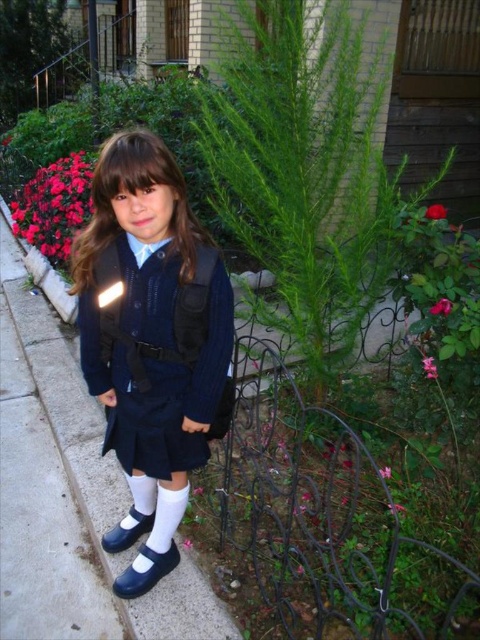
Question: Is white smooth sock at lower center below glossy rose at right?

Choices:
 (A) no
 (B) yes

Answer: (B)

Question: Is shiny black shoe at lower center closer to the viewer compared to matte blue shoe at lower left?

Choices:
 (A) yes
 (B) no

Answer: (A)

Question: Among these objects, which one is nearest to the camera?

Choices:
 (A) pink matte rose at center right
 (B) shiny black shoe at lower center

Answer: (B)

Question: Can you confirm if matte blue dress at center is wider than glossy rose at right?

Choices:
 (A) yes
 (B) no

Answer: (A)

Question: Which object appears closest to the camera in this image?

Choices:
 (A) white smooth sock at lower center
 (B) glossy rose at right
 (C) pink matte rose at center right
 (D) shiny black shoe at lower center

Answer: (D)

Question: Which point appears farthest from the camera in this image?

Choices:
 (A) tap(83, 216)
 (B) tap(172, 557)
 (C) tap(149, 524)

Answer: (A)